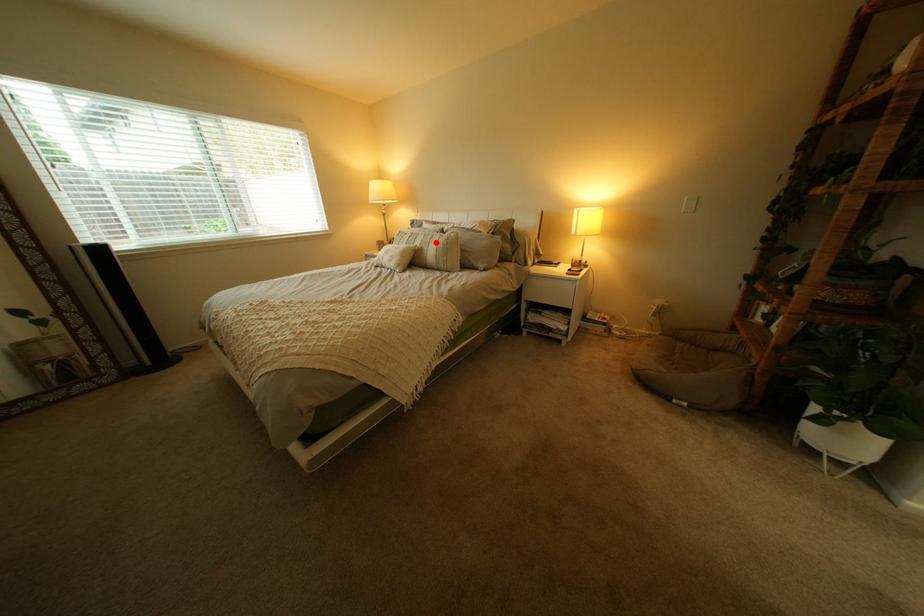
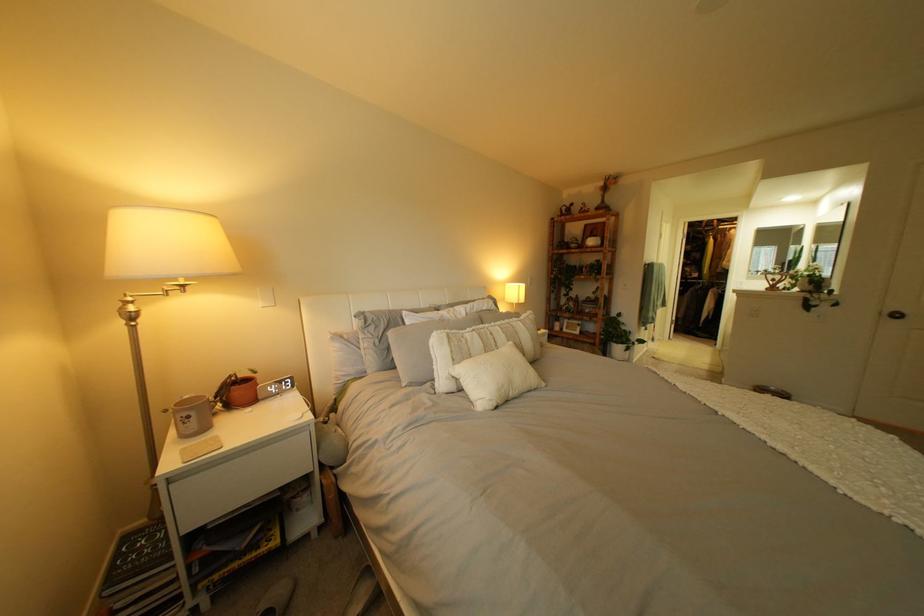
The point at the highlighted location is marked in the first image. Where is the corresponding point in the second image?

(518, 337)